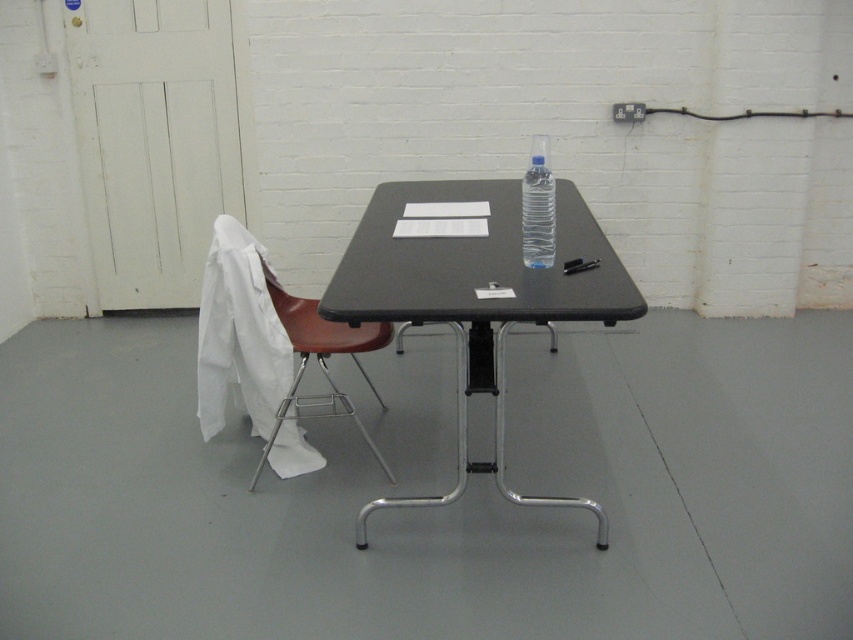
Question: Can you confirm if black plastic table at center is bigger than matte brown chair at left?

Choices:
 (A) no
 (B) yes

Answer: (B)

Question: Can you confirm if black plastic table at center is wider than matte brown chair at left?

Choices:
 (A) yes
 (B) no

Answer: (A)

Question: Among these points, which one is nearest to the camera?

Choices:
 (A) (202, 364)
 (B) (482, 257)
 (C) (378, 332)
 (D) (543, 198)

Answer: (D)

Question: Based on their relative distances, which object is nearer to the white fabric at left?

Choices:
 (A) clear plastic bottle at center
 (B) matte brown chair at left

Answer: (B)

Question: Which point is farther to the camera?

Choices:
 (A) (263, 275)
 (B) (524, 202)
 (C) (468, 198)
 (D) (306, 397)

Answer: (D)

Question: Does white fabric at left come behind clear plastic bottle at center?

Choices:
 (A) yes
 (B) no

Answer: (A)